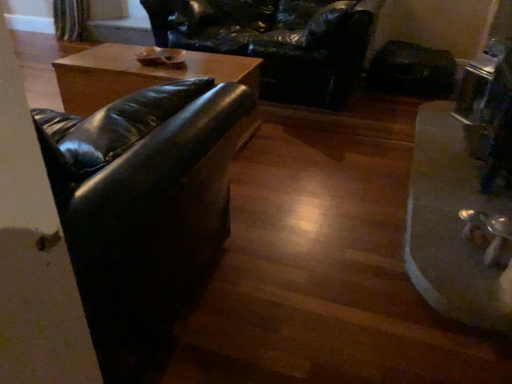
Question: Is point click(448, 142) closer or farther from the camera than point click(240, 21)?

Choices:
 (A) farther
 (B) closer

Answer: (B)

Question: From the image's perspective, is metallic silver tray at lower right above or below black leather swivel chair at upper center?

Choices:
 (A) above
 (B) below

Answer: (B)

Question: Which is farther from the metallic silver tray at lower right?

Choices:
 (A) black leather couch at left
 (B) black leather swivel chair at upper center

Answer: (B)

Question: Which object is the farthest from the metallic silver tray at lower right?

Choices:
 (A) black leather couch at left
 (B) black leather swivel chair at upper center

Answer: (B)